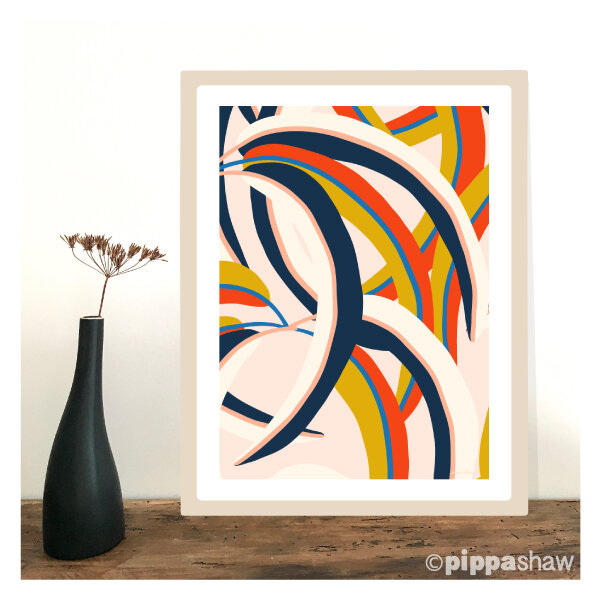
Locate an element on the screen. Image resolution: width=600 pixels, height=600 pixels. vase is located at coordinates (88, 500).